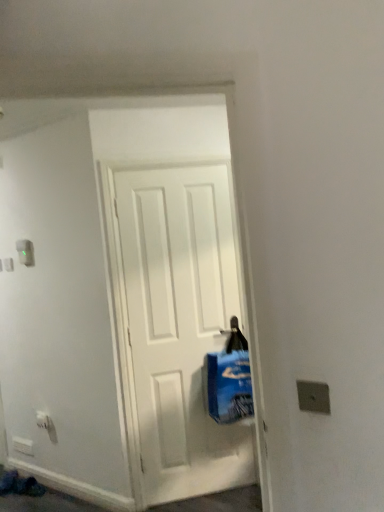
Question: Is white plastic electric outlet at lower left taller than blue plastic bag at center?

Choices:
 (A) yes
 (B) no

Answer: (B)

Question: Considering the relative positions of white plastic electric outlet at lower left and blue plastic bag at center in the image provided, is white plastic electric outlet at lower left to the left of blue plastic bag at center from the viewer's perspective?

Choices:
 (A) no
 (B) yes

Answer: (B)

Question: Is white plastic electric outlet at lower left further to the viewer compared to blue plastic bag at center?

Choices:
 (A) yes
 (B) no

Answer: (A)

Question: Is white plastic electric outlet at lower left at the right side of blue plastic bag at center?

Choices:
 (A) yes
 (B) no

Answer: (B)

Question: Is white plastic electric outlet at lower left outside of blue plastic bag at center?

Choices:
 (A) no
 (B) yes

Answer: (B)

Question: In the image, is blue plastic bag at center positioned in front of or behind white plastic light switch at upper left?

Choices:
 (A) behind
 (B) front

Answer: (B)

Question: From the image's perspective, is blue plastic bag at center above or below white plastic light switch at upper left?

Choices:
 (A) below
 (B) above

Answer: (A)

Question: Is blue plastic bag at center wider or thinner than white plastic light switch at upper left?

Choices:
 (A) wide
 (B) thin

Answer: (A)

Question: From a real-world perspective, is blue plastic bag at center positioned above or below white plastic light switch at upper left?

Choices:
 (A) above
 (B) below

Answer: (B)

Question: Is white plastic electric outlet at lower left in front of or behind blue plastic bag at center in the image?

Choices:
 (A) behind
 (B) front

Answer: (A)

Question: In the image, is white plastic electric outlet at lower left on the left side or the right side of blue plastic bag at center?

Choices:
 (A) right
 (B) left

Answer: (B)

Question: Would you say white plastic electric outlet at lower left is inside or outside blue plastic bag at center?

Choices:
 (A) inside
 (B) outside

Answer: (B)

Question: In terms of size, does white plastic electric outlet at lower left appear bigger or smaller than blue plastic bag at center?

Choices:
 (A) big
 (B) small

Answer: (B)

Question: In terms of size, does white plastic light switch at upper left appear bigger or smaller than blue plastic bag at center?

Choices:
 (A) small
 (B) big

Answer: (A)

Question: Would you say white plastic light switch at upper left is to the left or to the right of blue plastic bag at center in the picture?

Choices:
 (A) left
 (B) right

Answer: (A)